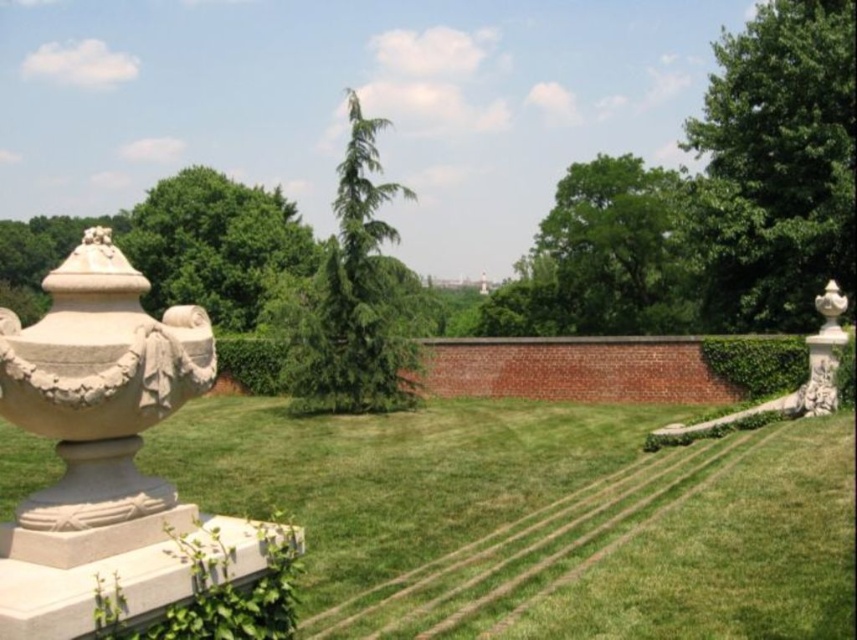
You are standing at the point marked by the coordinates point (612,250) in the image. Looking around, you see a green leafy tree at upper center. What direction should you face to see the large ornate stone urn or vase on the left side of the frame?

You should face to the left side of the frame to see the large ornate stone urn or vase, as it is positioned on the left side of the frame while you are at point (612,250).